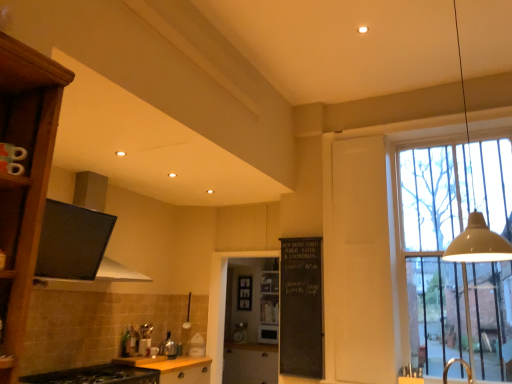
At what (x,y) coordinates should I click in order to perform the action: click on empty space that is ontop of black matte exhaust hood at upper left (from a real-world perspective). Please return your answer as a coordinate pair (x, y). Looking at the image, I should click on click(104, 175).